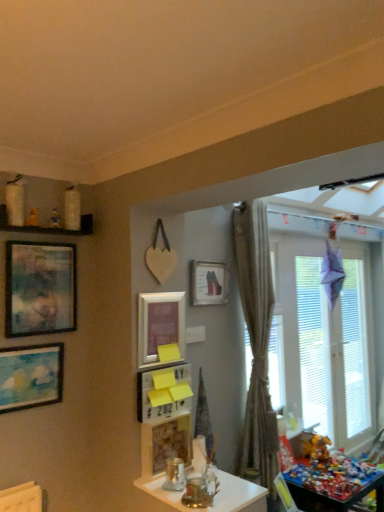
Question: Is multicolored plastic toys at lower right, which is counted as the 1th table, starting from the right, located outside white frosted glass window at right?

Choices:
 (A) no
 (B) yes

Answer: (B)

Question: Would you consider multicolored plastic toys at lower right, the first table ordered from the bottom, to be distant from white frosted glass window at right?

Choices:
 (A) no
 (B) yes

Answer: (A)

Question: Is white frosted glass window at right at the back of multicolored plastic toys at lower right, the second table in the front-to-back sequence?

Choices:
 (A) no
 (B) yes

Answer: (A)

Question: Considering the relative sizes of multicolored plastic toys at lower right, the second table from the top, and white frosted glass window at right in the image provided, is multicolored plastic toys at lower right, the second table from the top, bigger than white frosted glass window at right?

Choices:
 (A) yes
 (B) no

Answer: (B)

Question: Is multicolored plastic toys at lower right, placed as the second table when sorted from left to right, behind white frosted glass window at right?

Choices:
 (A) no
 (B) yes

Answer: (A)

Question: In terms of size, does multicolored plastic toys at lower right, the second table from the top, appear bigger or smaller than white glossy jars at upper left?

Choices:
 (A) big
 (B) small

Answer: (A)

Question: Is multicolored plastic toys at lower right, the second table from the top, wider or thinner than white glossy jars at upper left?

Choices:
 (A) wide
 (B) thin

Answer: (A)

Question: Considering the positions of point (327, 494) and point (4, 204), is point (327, 494) closer or farther from the camera than point (4, 204)?

Choices:
 (A) farther
 (B) closer

Answer: (A)

Question: From the image's perspective, is multicolored plastic toys at lower right, the second table from the top, positioned above or below white glossy jars at upper left?

Choices:
 (A) below
 (B) above

Answer: (A)

Question: Is point (153, 495) positioned closer to the camera than point (213, 280)?

Choices:
 (A) closer
 (B) farther

Answer: (A)

Question: Considering the positions of translucent glass table at center, which appears as the 2th table when viewed from the right, and matte white picture frame at center, positioned as the first picture frame in right-to-left order, in the image, is translucent glass table at center, which appears as the 2th table when viewed from the right, bigger or smaller than matte white picture frame at center, positioned as the first picture frame in right-to-left order,?

Choices:
 (A) small
 (B) big

Answer: (B)

Question: Looking at their shapes, would you say translucent glass table at center, the 2th table positioned from the back, is wider or thinner than matte white picture frame at center, which is counted as the 5th picture frame, starting from the left?

Choices:
 (A) wide
 (B) thin

Answer: (A)

Question: From a real-world perspective, relative to matte white picture frame at center, which is counted as the 5th picture frame, starting from the left, is translucent glass table at center, which appears as the 2th table when viewed from the right, vertically above or below?

Choices:
 (A) below
 (B) above

Answer: (A)

Question: Considering the positions of matte blue painting at left, which is the 5th picture frame from right to left, and multicolored plastic toys at lower right, which is counted as the 1th table, starting from the right, in the image, is matte blue painting at left, which is the 5th picture frame from right to left, taller or shorter than multicolored plastic toys at lower right, which is counted as the 1th table, starting from the right,?

Choices:
 (A) tall
 (B) short

Answer: (B)

Question: Is matte blue painting at left, the 1th picture frame positioned from the left, bigger or smaller than multicolored plastic toys at lower right, positioned as the 1th table in back-to-front order?

Choices:
 (A) small
 (B) big

Answer: (A)